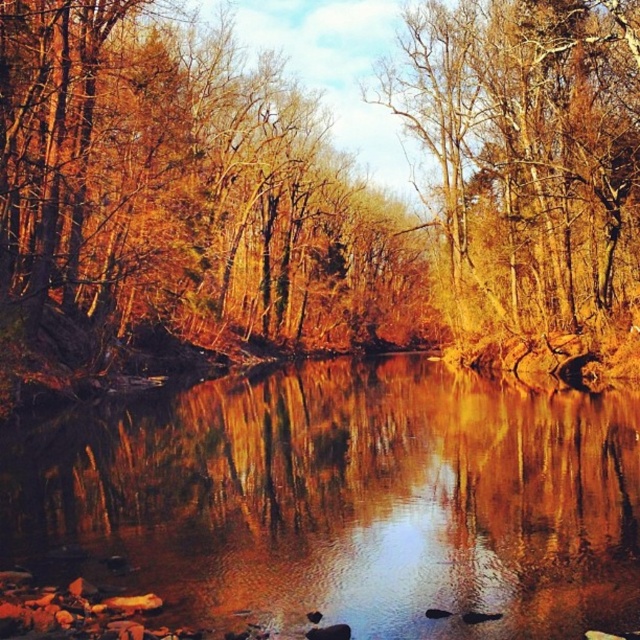
You are standing on the riverbank and want to take a photo of the shiny reflective water at center. Where should you position yourself to capture the reflection clearly?

You should position yourself directly above the shiny reflective water at center at point (342, 500) to capture the reflection clearly.

You are an artist planning to paint the autumn river scene. You want to ensure that the shiny reflective water at center and the golden textured tree at upper center are both visible in your painting. Based on their sizes in the image, which object should you focus on depicting first to ensure it takes up more space in your composition?

The golden textured tree at upper center occupies more space than the shiny reflective water at center, so you should focus on depicting the golden textured tree at upper center first to ensure it takes up the appropriate amount of space in your composition.

You are standing on the riverbank and see the shiny reflective water at center and the golden textured tree at upper center. Which object is closer to the water surface?

The shiny reflective water at center is closer to the water surface because it is located below the golden textured tree at upper center.